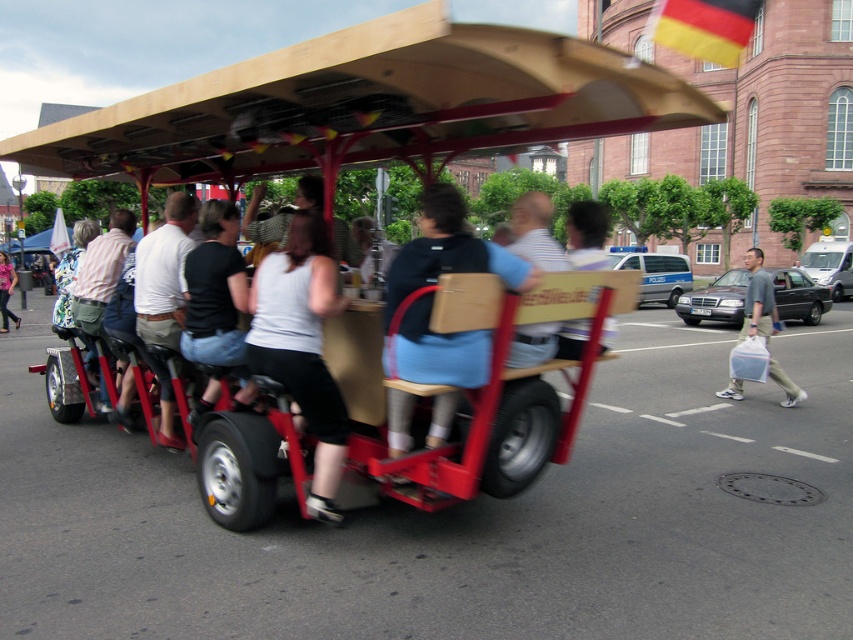
Question: Which is farther from the yellow fabric flag at upper right?

Choices:
 (A) silver metallic police car at center
 (B) metallic red golf cart at center
 (C) white matte shirt at center

Answer: (C)

Question: Does metallic red golf cart at center appear under gray fabric bag at lower right?

Choices:
 (A) no
 (B) yes

Answer: (A)

Question: Which of the following is the closest to the observer?

Choices:
 (A) click(636, 260)
 (B) click(801, 320)

Answer: (B)

Question: Does light blue denim jacket at center come in front of denim jacket at lower left?

Choices:
 (A) yes
 (B) no

Answer: (A)

Question: Can you confirm if black cotton shirt at center is positioned above black glossy sedan at center?

Choices:
 (A) no
 (B) yes

Answer: (A)

Question: Which point is closer to the camera taking this photo?

Choices:
 (A) (630, 250)
 (B) (310, 147)
 (C) (13, 269)

Answer: (B)